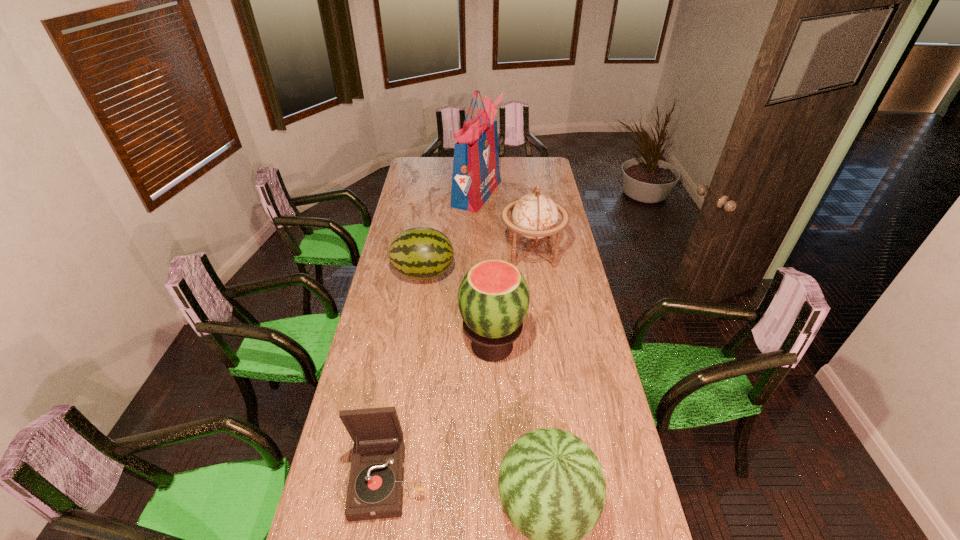
This screenshot has width=960, height=540. I want to click on vacant space located 0.050m at the front of the globe showing Africa, so click(490, 253).

Find the location of a particular element. Image resolution: width=960 pixels, height=540 pixels. free space located on the back of the third nearest object is located at coordinates (491, 271).

Identify the location of free space located 0.120m on the right of the phonograph record. tap(468, 480).

Where is `vacant space located 0.060m at the stem end of the shortest watermelon`? The image size is (960, 540). vacant space located 0.060m at the stem end of the shortest watermelon is located at coordinates (468, 273).

The height and width of the screenshot is (540, 960). I want to click on phonograph record at the left edge, so click(375, 490).

Find the location of a particular element. This screenshot has width=960, height=540. watermelon that is at the left edge is located at coordinates (421, 253).

The height and width of the screenshot is (540, 960). Identify the location of object located in the right edge section of the desktop. (535, 215).

At what (x,y) coordinates should I click in order to perform the action: click on free region at the left edge of the desktop. Please return your answer as a coordinate pair (x, y). The image size is (960, 540). Looking at the image, I should click on (428, 181).

Locate an element on the screen. This screenshot has height=540, width=960. vacant area at the right edge is located at coordinates (613, 410).

The image size is (960, 540). In the image, there is a desktop. In order to click on vacant space at the far left corner in this screenshot , I will do `click(422, 172)`.